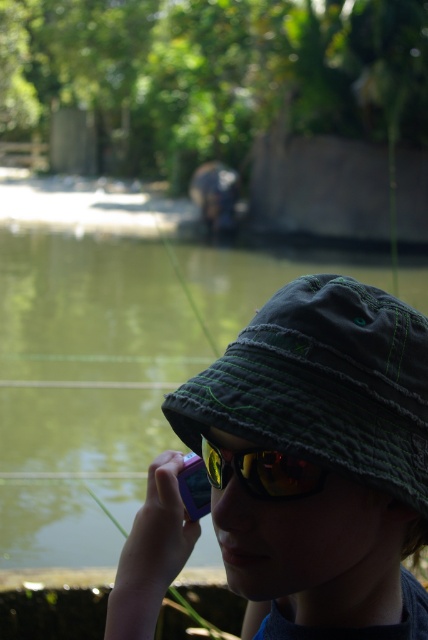
Does matte green bucket hat at center come in front of yellow reflective lens at center?

Yes, matte green bucket hat at center is in front of yellow reflective lens at center.

From the picture: Can you confirm if matte green bucket hat at center is thinner than yellow reflective lens at center?

In fact, matte green bucket hat at center might be wider than yellow reflective lens at center.

The width and height of the screenshot is (428, 640). Describe the element at coordinates (318, 460) in the screenshot. I see `matte green bucket hat at center` at that location.

Identify the location of matte green bucket hat at center. Image resolution: width=428 pixels, height=640 pixels. (318, 460).